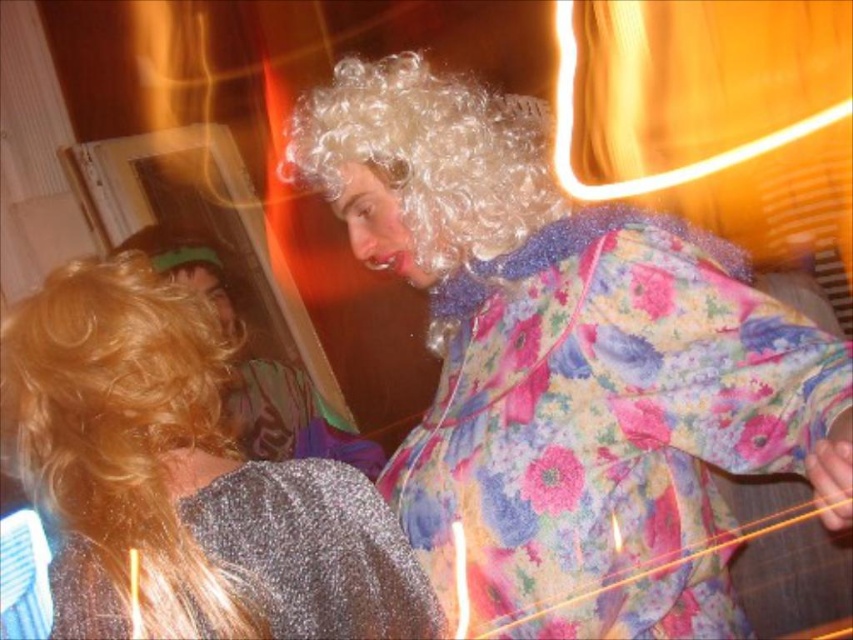
Can you confirm if shiny silver dress at lower left is taller than sparkly silver robe at lower left?

Yes.

Does shiny silver dress at lower left appear over sparkly silver robe at lower left?

Yes, shiny silver dress at lower left is above sparkly silver robe at lower left.

This screenshot has width=853, height=640. Describe the element at coordinates (184, 477) in the screenshot. I see `shiny silver dress at lower left` at that location.

I want to click on shiny silver dress at lower left, so click(x=184, y=477).

Does floral fabric dress at upper right appear over shiny silver dress at lower left?

Yes.

Who is more forward, (426, 493) or (311, 531)?

Point (311, 531) is in front.

The image size is (853, 640). What do you see at coordinates (560, 346) in the screenshot?
I see `floral fabric dress at upper right` at bounding box center [560, 346].

The width and height of the screenshot is (853, 640). Find the location of `floral fabric dress at upper right`. floral fabric dress at upper right is located at coordinates (560, 346).

Between floral fabric dress at upper right and sparkly silver robe at lower left, which one has less height?

sparkly silver robe at lower left is shorter.

Between floral fabric dress at upper right and sparkly silver robe at lower left, which one is positioned lower?

sparkly silver robe at lower left is below.

This screenshot has height=640, width=853. In order to click on floral fabric dress at upper right in this screenshot , I will do `click(560, 346)`.

Locate an element on the screen. This screenshot has width=853, height=640. floral fabric dress at upper right is located at coordinates (560, 346).